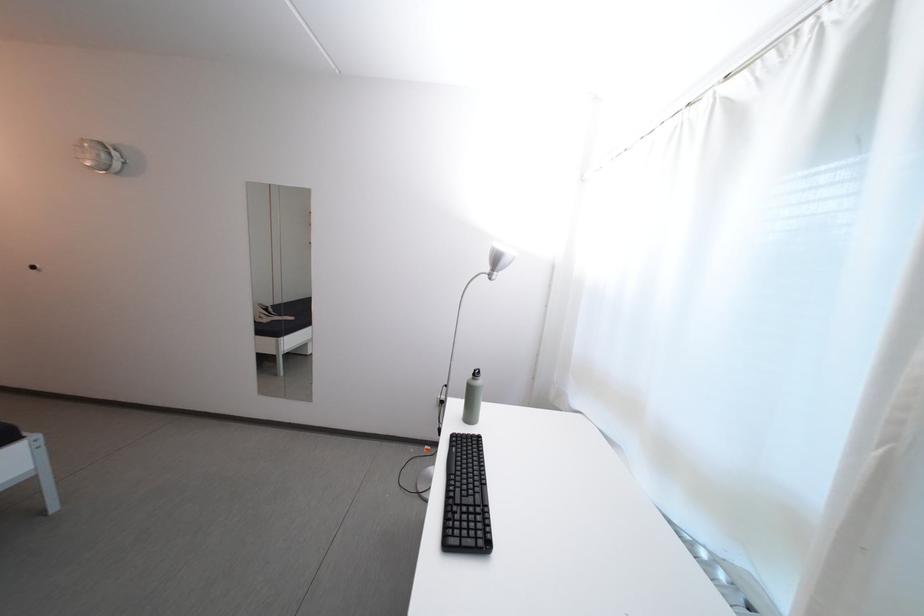
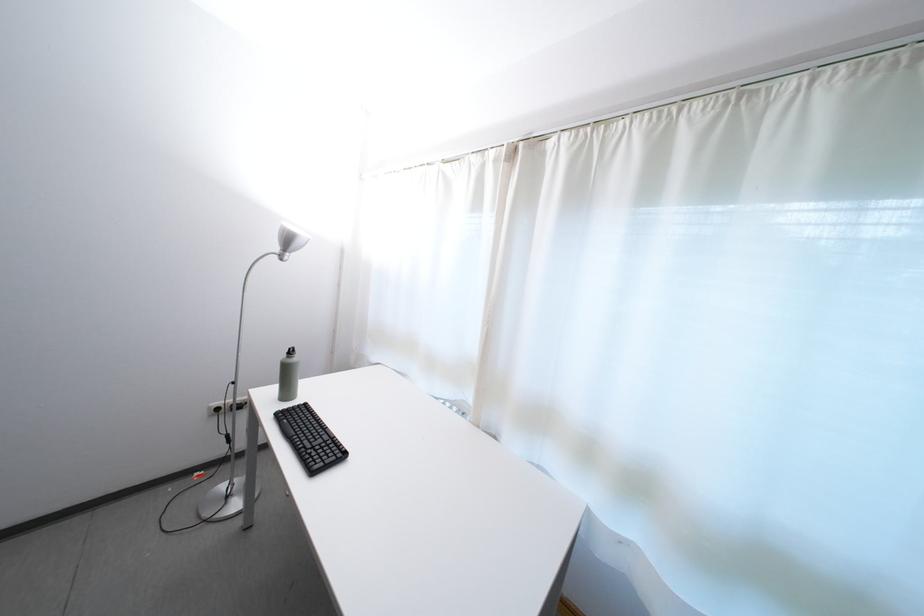
Locate, in the second image, the point that corresponds to pixel 496 275 in the first image.

(286, 254)